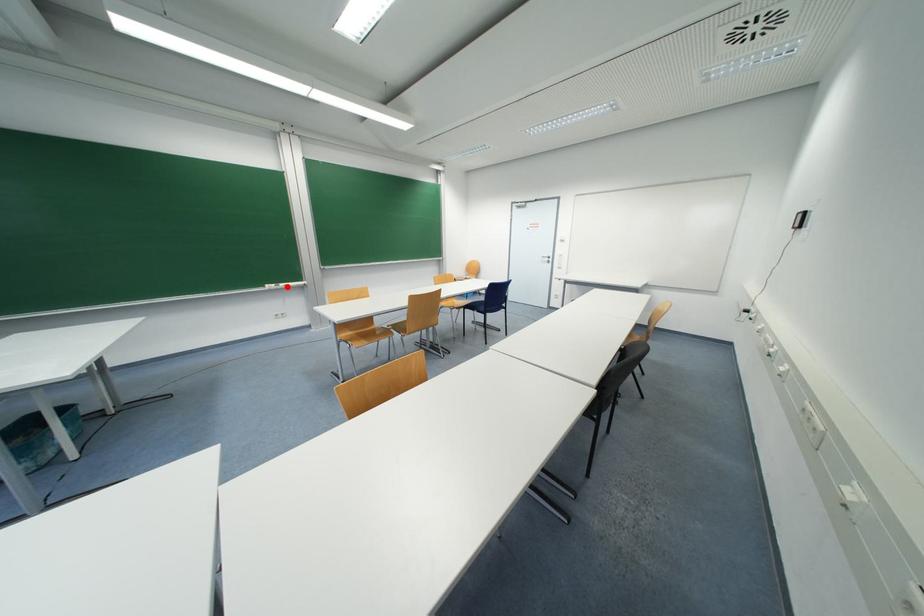
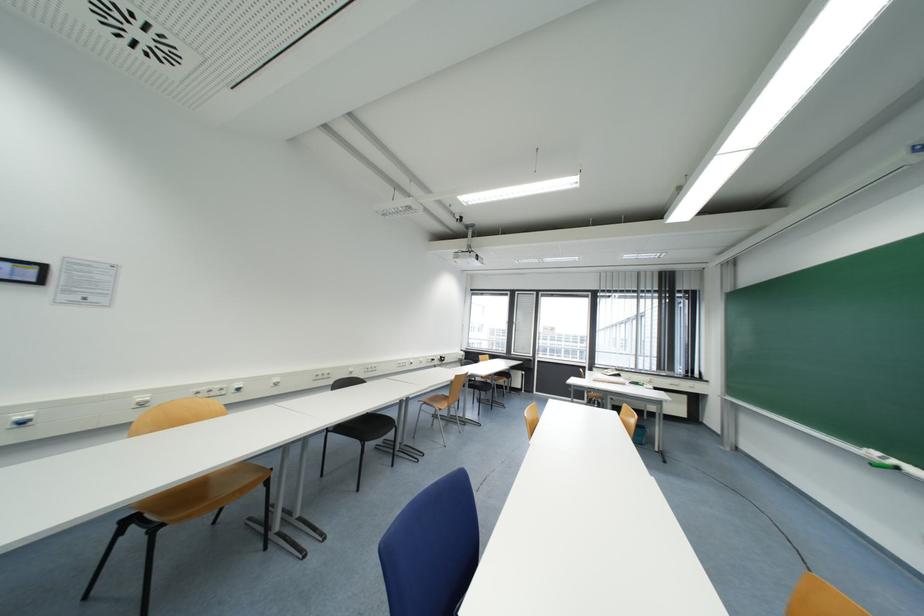
Where in the second image is the point corresponding to the highlighted location from the first image?

(898, 464)